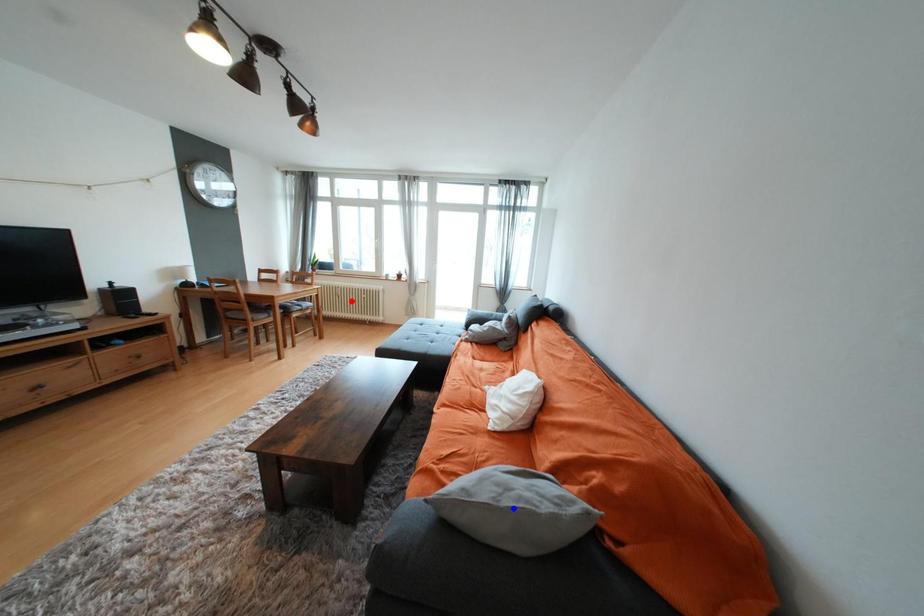
Question: Which of the two points in the image is closer to the camera?

Choices:
 (A) Blue point is closer.
 (B) Red point is closer.

Answer: (A)